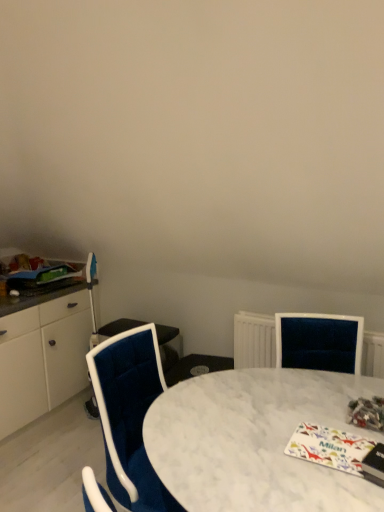
Question: Can you confirm if white marble table at center is smaller than velvet blue chair at center?

Choices:
 (A) no
 (B) yes

Answer: (B)

Question: Does white marble table at center lie behind velvet blue chair at center?

Choices:
 (A) yes
 (B) no

Answer: (B)

Question: From a real-world perspective, is white marble table at center beneath velvet blue chair at center?

Choices:
 (A) yes
 (B) no

Answer: (B)

Question: Can you confirm if white marble table at center is bigger than velvet blue chair at center?

Choices:
 (A) yes
 (B) no

Answer: (B)

Question: Is white marble table at center turned away from velvet blue chair at center?

Choices:
 (A) yes
 (B) no

Answer: (B)

Question: Which is correct: multicolored glossy magazine at lower right, arranged as the 3th magazine when viewed from the left, is inside white glossy magazine at lower right, the 2th magazine when ordered from left to right, or outside of it?

Choices:
 (A) outside
 (B) inside

Answer: (A)

Question: Would you say multicolored glossy magazine at lower right, placed as the first magazine when sorted from front to back, is to the left or to the right of white glossy magazine at lower right, the 2th magazine viewed from the back, in the picture?

Choices:
 (A) left
 (B) right

Answer: (B)

Question: Considering the positions of multicolored glossy magazine at lower right, which is counted as the second magazine, starting from the bottom, and white glossy magazine at lower right, the 2th magazine viewed from the back, in the image, is multicolored glossy magazine at lower right, which is counted as the second magazine, starting from the bottom, bigger or smaller than white glossy magazine at lower right, the 2th magazine viewed from the back,?

Choices:
 (A) big
 (B) small

Answer: (A)

Question: Looking at their shapes, would you say multicolored glossy magazine at lower right, the 1th magazine when ordered from right to left, is wider or thinner than white glossy magazine at lower right, which is the third magazine from top to bottom?

Choices:
 (A) thin
 (B) wide

Answer: (A)

Question: Is point (157, 488) closer or farther from the camera than point (29, 272)?

Choices:
 (A) farther
 (B) closer

Answer: (B)

Question: Considering their positions, is velvet blue chair at center located in front of or behind matte green magazine at left, the 1th magazine when ordered from left to right?

Choices:
 (A) front
 (B) behind

Answer: (A)

Question: From a real-world perspective, is velvet blue chair at center physically located above or below matte green magazine at left, which ranks as the 1th magazine in top-to-bottom order?

Choices:
 (A) below
 (B) above

Answer: (A)

Question: Considering the positions of velvet blue chair at center and matte green magazine at left, which is counted as the 3th magazine, starting from the right, in the image, is velvet blue chair at center wider or thinner than matte green magazine at left, which is counted as the 3th magazine, starting from the right,?

Choices:
 (A) thin
 (B) wide

Answer: (B)

Question: Looking at their shapes, would you say matte green magazine at left, the 3th magazine viewed from the front, is wider or thinner than velvet blue chair at center?

Choices:
 (A) thin
 (B) wide

Answer: (A)

Question: Relative to velvet blue chair at center, is matte green magazine at left, the 1th magazine when ordered from left to right, in front or behind?

Choices:
 (A) front
 (B) behind

Answer: (B)